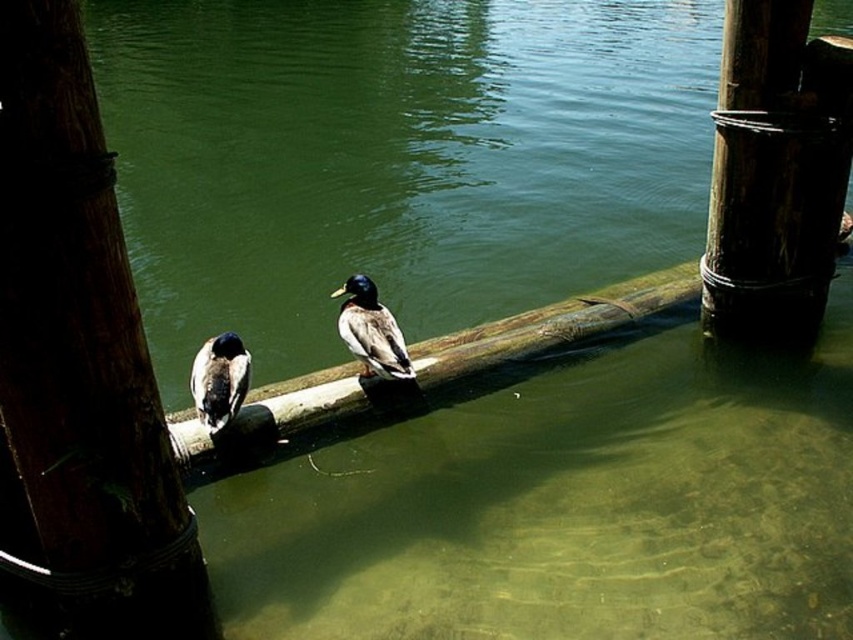
Question: Which object appears farthest from the camera in this image?

Choices:
 (A) dark brown wood pole at left
 (B) greenish-brown feathers duck at center
 (C) shiny brown duck at left
 (D) rough wooden pole at center right

Answer: (D)

Question: Is dark brown wood pole at left below shiny brown duck at left?

Choices:
 (A) no
 (B) yes

Answer: (A)

Question: Is greenish-brown feathers duck at center above shiny brown duck at left?

Choices:
 (A) no
 (B) yes

Answer: (B)

Question: Where is rough wooden pole at center right located in relation to greenish-brown feathers duck at center in the image?

Choices:
 (A) above
 (B) below

Answer: (A)

Question: Among these points, which one is nearest to the camera?

Choices:
 (A) (751, 22)
 (B) (57, 454)
 (C) (376, 305)

Answer: (B)

Question: Which of the following is the farthest from the observer?

Choices:
 (A) (743, 209)
 (B) (244, 396)

Answer: (A)